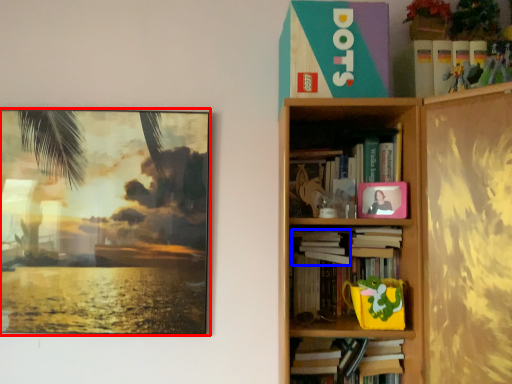
Question: Among these objects, which one is nearest to the camera, picture frame (highlighted by a red box) or book (highlighted by a blue box)?

Choices:
 (A) picture frame
 (B) book

Answer: (B)